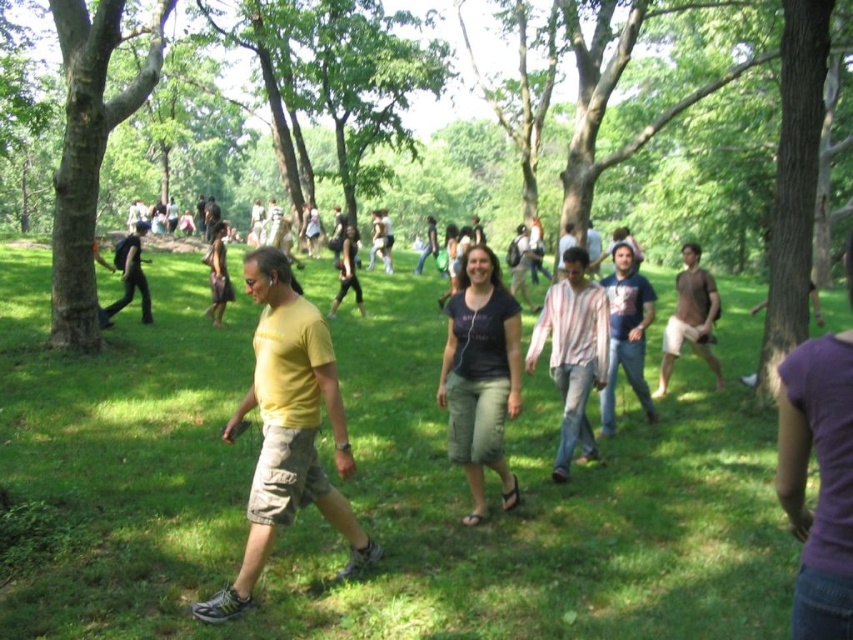
Between point (288, 324) and point (570, 234), which one is positioned behind?

The point (570, 234) is more distant.

Who is positioned more to the right, yellow matte t-shirt at center or matte white shirt at center?

Positioned to the right is matte white shirt at center.

I want to click on yellow matte t-shirt at center, so click(x=287, y=429).

This screenshot has width=853, height=640. Find the location of `striped cotton shirt at center`. striped cotton shirt at center is located at coordinates (573, 353).

Based on the photo, between striped cotton shirt at center and matte black backpack at left, which one appears on the left side from the viewer's perspective?

From the viewer's perspective, matte black backpack at left appears more on the left side.

Is point (560, 296) farther from camera compared to point (129, 296)?

No, it is not.

Where is `striped cotton shirt at center`? This screenshot has height=640, width=853. striped cotton shirt at center is located at coordinates (573, 353).

Does yellow matte t-shirt at center appear on the right side of striped cotton shirt at center?

In fact, yellow matte t-shirt at center is to the left of striped cotton shirt at center.

Can you confirm if yellow matte t-shirt at center is shorter than striped cotton shirt at center?

Incorrect, yellow matte t-shirt at center's height does not fall short of striped cotton shirt at center's.

Is point (267, 476) closer to camera compared to point (555, 378)?

Yes, point (267, 476) is in front of point (555, 378).

Locate an element on the screen. This screenshot has width=853, height=640. yellow matte t-shirt at center is located at coordinates (287, 429).